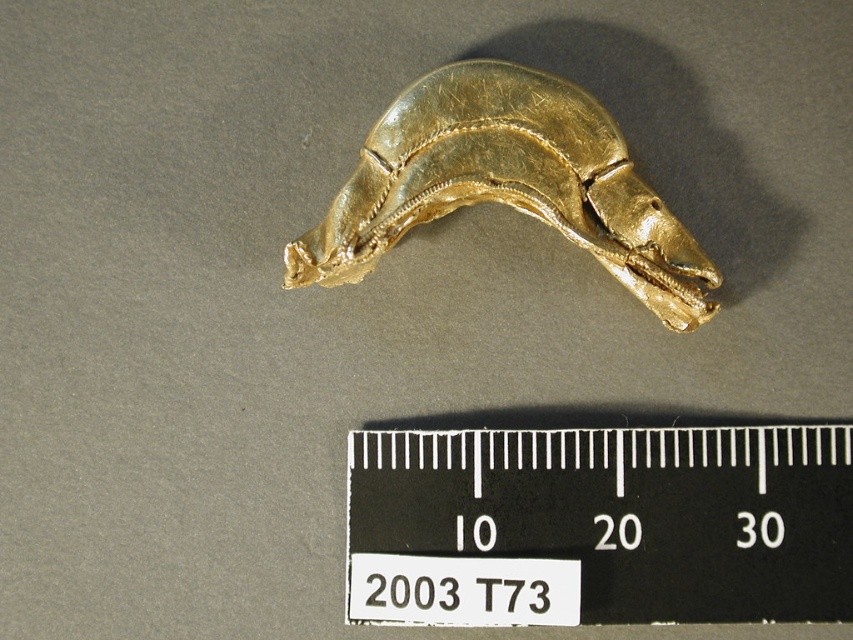
You are an archaeologist examining the gold shiny horse at center and the black plastic ruler at center in the image. Which object is closer to your eyes?

The black plastic ruler at center is closer to your eyes than the gold shiny horse at center.

You are an archaeologist examining the golden artifact and the black plastic ruler at center in the image. What does the point at coordinates (601,525) represent?

The point at coordinates (601,525) indicates the location of the black plastic ruler at center.